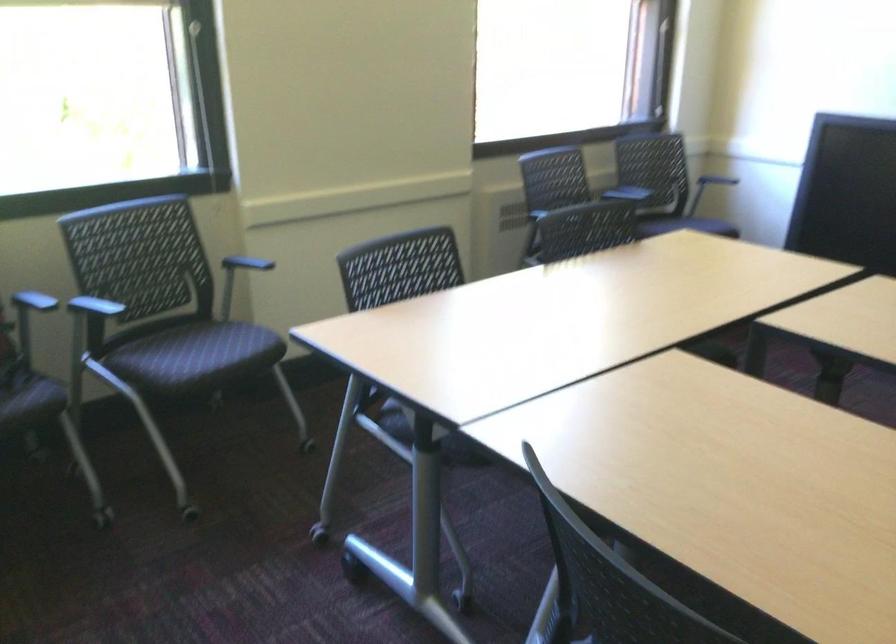
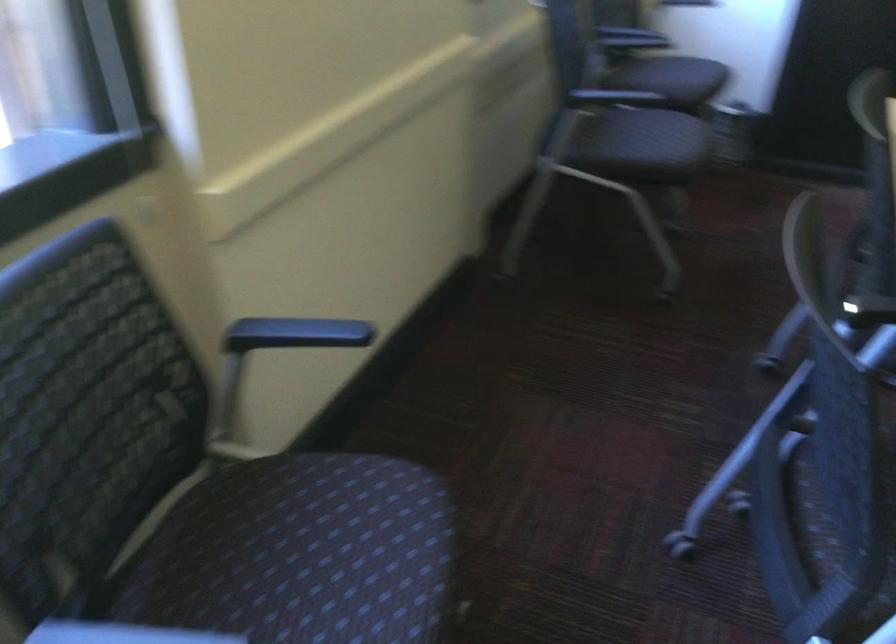
Which direction would the cameraman need to move to produce the second image?

The movement direction of the cameraman is left, forward.